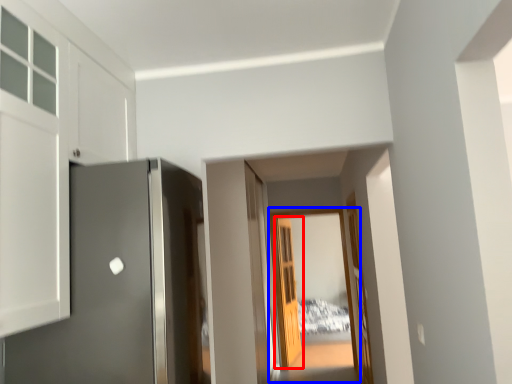
Question: Which point is further to the camera, door (highlighted by a red box) or glass door (highlighted by a blue box)?

Choices:
 (A) door
 (B) glass door

Answer: (A)